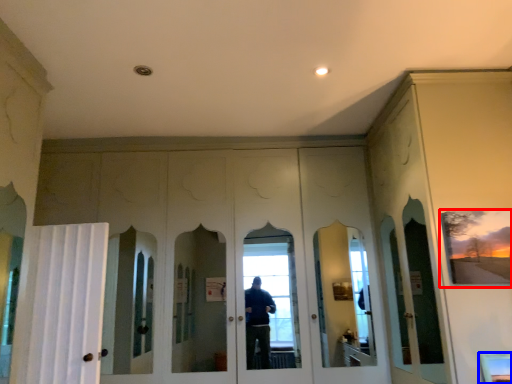
Question: Which of the following is the closest to the observer, picture frame (highlighted by a red box) or window (highlighted by a blue box)?

Choices:
 (A) picture frame
 (B) window

Answer: (B)